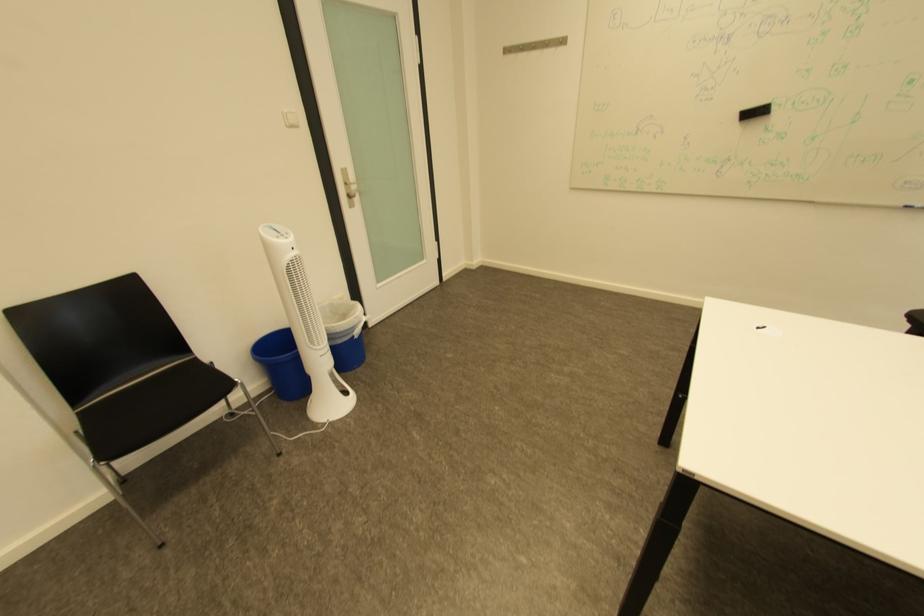
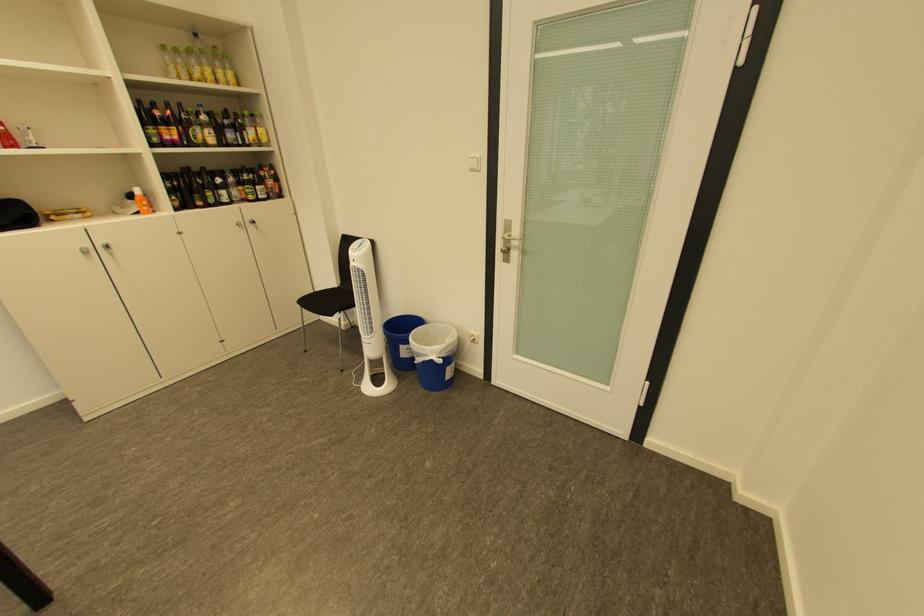
In the second image, find the point that corresponds to the point at 362,330 in the first image.

(429, 355)